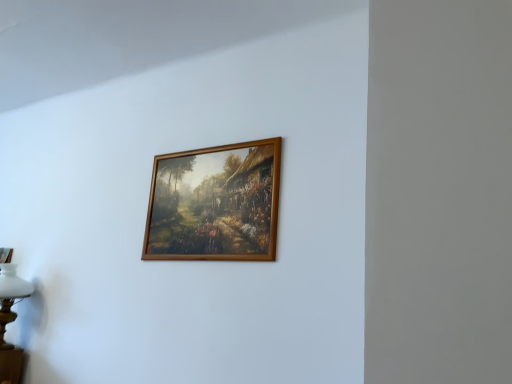
Question: Is white glass table lamp at lower left shorter than wooden frame at center?

Choices:
 (A) yes
 (B) no

Answer: (A)

Question: Does white glass table lamp at lower left come behind wooden frame at center?

Choices:
 (A) no
 (B) yes

Answer: (B)

Question: Is white glass table lamp at lower left taller than wooden frame at center?

Choices:
 (A) no
 (B) yes

Answer: (A)

Question: From a real-world perspective, is white glass table lamp at lower left on wooden frame at center?

Choices:
 (A) no
 (B) yes

Answer: (A)

Question: From the image's perspective, does white glass table lamp at lower left appear higher than wooden frame at center?

Choices:
 (A) yes
 (B) no

Answer: (B)

Question: Is wooden frame at center located within white glass table lamp at lower left?

Choices:
 (A) yes
 (B) no

Answer: (B)

Question: Does wooden frame at center have a smaller size compared to white glass table lamp at lower left?

Choices:
 (A) no
 (B) yes

Answer: (B)

Question: Could white glass table lamp at lower left be considered to be inside wooden frame at center?

Choices:
 (A) yes
 (B) no

Answer: (B)

Question: Considering the relative sizes of wooden frame at center and white glass table lamp at lower left in the image provided, is wooden frame at center taller than white glass table lamp at lower left?

Choices:
 (A) no
 (B) yes

Answer: (B)

Question: From a real-world perspective, is wooden frame at center below white glass table lamp at lower left?

Choices:
 (A) no
 (B) yes

Answer: (A)

Question: Is wooden frame at center thinner than white glass table lamp at lower left?

Choices:
 (A) no
 (B) yes

Answer: (B)

Question: Is wooden frame at center not inside white glass table lamp at lower left?

Choices:
 (A) yes
 (B) no

Answer: (A)

Question: Is wooden frame at center wider or thinner than white glass table lamp at lower left?

Choices:
 (A) wide
 (B) thin

Answer: (B)